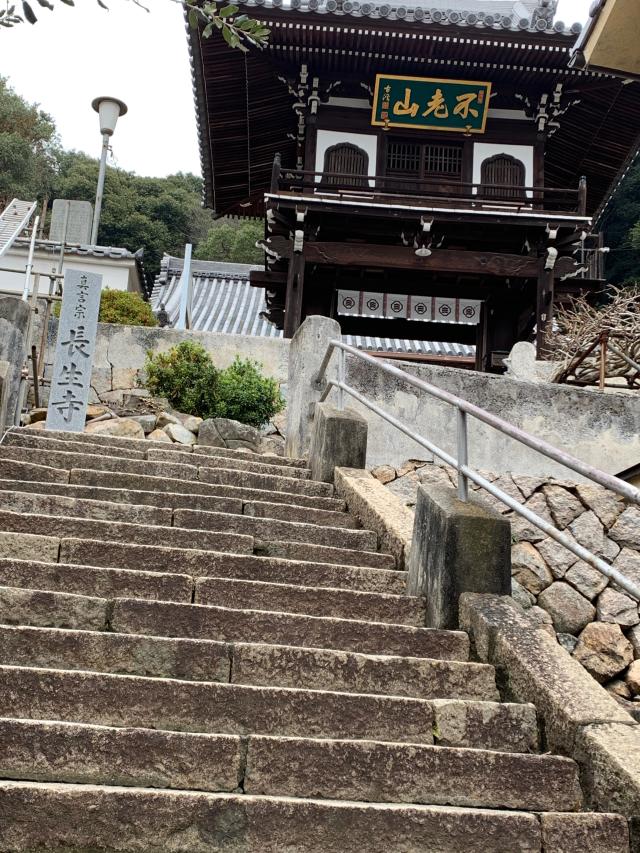
The width and height of the screenshot is (640, 853). I want to click on metal handrail, so click(614, 576), click(425, 442), click(556, 453), click(464, 450), click(372, 357), click(358, 393).